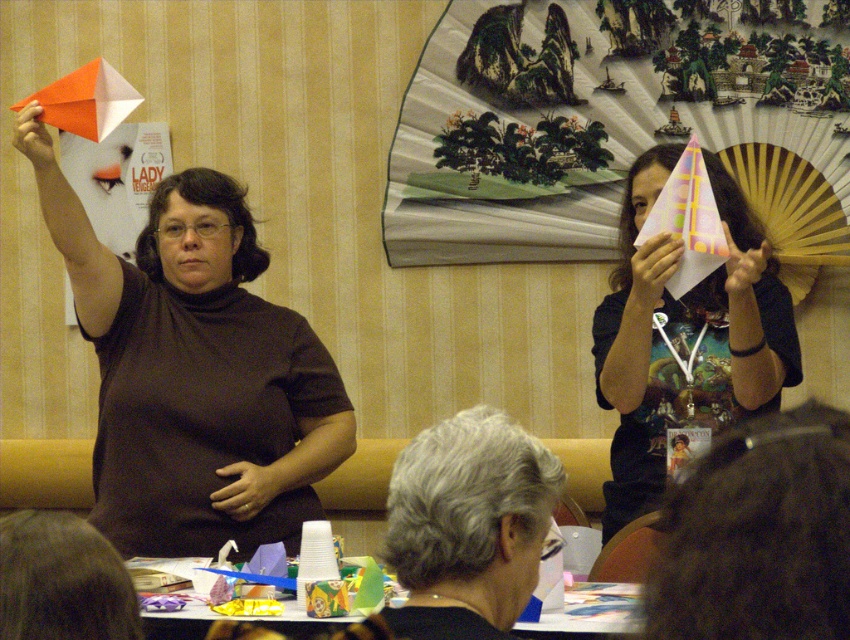
Is matte brown shirt at upper left taller than cardboard paper at lower center?

Indeed, matte brown shirt at upper left has a greater height compared to cardboard paper at lower center.

The width and height of the screenshot is (850, 640). Describe the element at coordinates (193, 371) in the screenshot. I see `matte brown shirt at upper left` at that location.

The height and width of the screenshot is (640, 850). What do you see at coordinates (193, 371) in the screenshot?
I see `matte brown shirt at upper left` at bounding box center [193, 371].

The image size is (850, 640). Identify the location of matte brown shirt at upper left. (193, 371).

Which is behind, point (401, 563) or point (282, 616)?

The point (282, 616) is behind.

Find the location of a particular element. The height and width of the screenshot is (640, 850). gray hair at upper center is located at coordinates (468, 525).

Is point (451, 628) positioned behind point (309, 634)?

No, (451, 628) is closer to viewer.

The image size is (850, 640). I want to click on gray hair at upper center, so click(468, 525).

Which of these two, matte brown shirt at upper left or gray hair at upper center, stands shorter?

Standing shorter between the two is gray hair at upper center.

Can you confirm if matte brown shirt at upper left is shorter than gray hair at upper center?

In fact, matte brown shirt at upper left may be taller than gray hair at upper center.

Between point (292, 396) and point (476, 448), which one is positioned behind?

The point (292, 396) is more distant.

Locate an element on the screen. matte brown shirt at upper left is located at coordinates (193, 371).